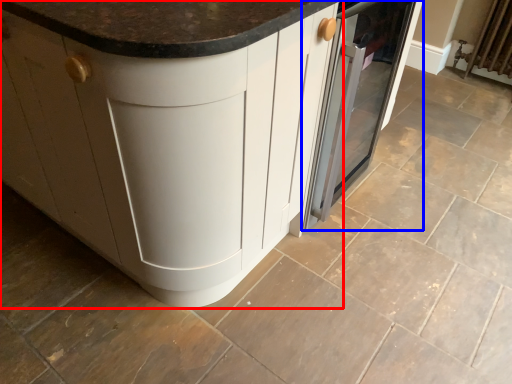
Question: Among these objects, which one is farthest to the camera, cabinetry (highlighted by a red box) or home appliance (highlighted by a blue box)?

Choices:
 (A) cabinetry
 (B) home appliance

Answer: (B)